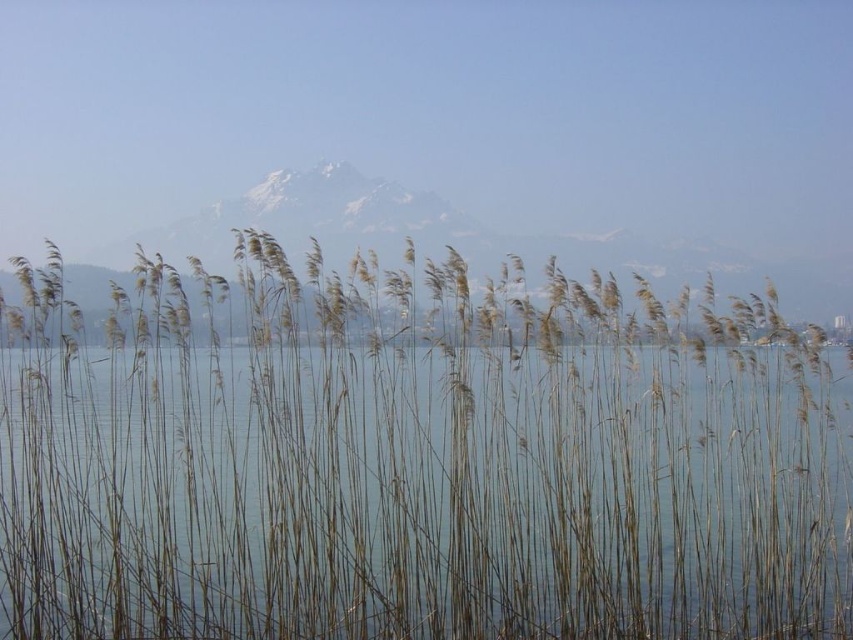
You are standing in the serene landscape and want to walk from the dry reeds at center to the snowy rock mountain at center. Which direction should you head to reach the mountain?

You should head to the right to reach the snowy rock mountain at center because the dry reeds at center are to the left of it.

You are standing in a field of reeds and see a point marked at coordinates [416,472]. Based on the scene description, what is located at that point?

The point at [416,472] indicates dry reeds at center.